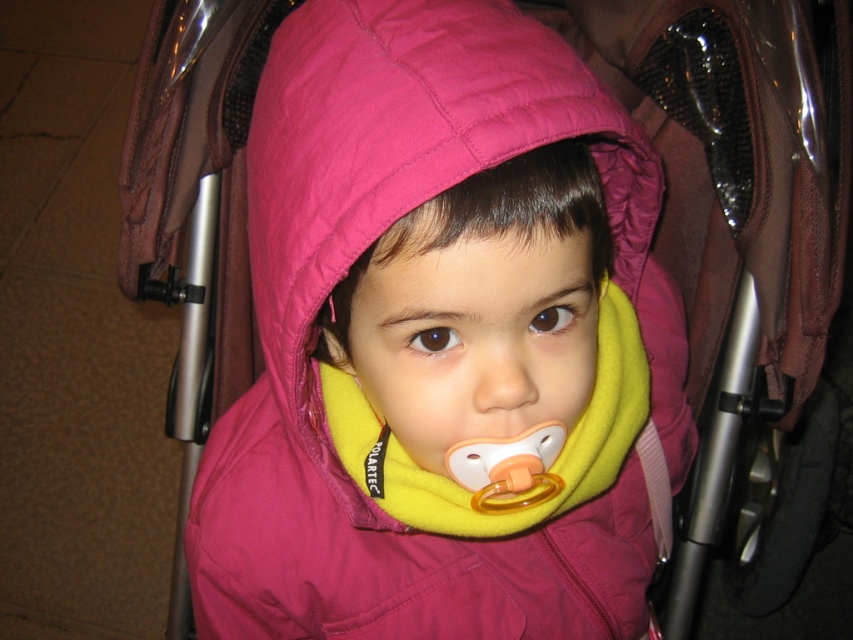
A toy car is 3 inches long. If you place it between the pink fleece jacket at center and the yellow rubber teething ring at center, will it fit without overlapping either object?

The distance between the pink fleece jacket at center and the yellow rubber teething ring at center is 3.51 inches. Since the toy car is 3 inches long, it will fit between them without overlapping either object.

You are a parent trying to ensure your child stays warm in the stroller. The child is wearing a pink fleece jacket at center and has a yellow rubber teething ring at center. Which item is taller and would provide more coverage against the cold?

The pink fleece jacket at center is much taller than the yellow rubber teething ring at center, so it provides more coverage against the cold.

You are a photographer trying to capture a closeup of the yellow rubber teething ring at center. However, the pink fleece jacket at center is blocking your view. Can you adjust your position to see the teething ring without moving any objects?

The pink fleece jacket at center is closer to the viewer than the yellow rubber teething ring at center. To see the teething ring without moving objects, you would need to move your camera position behind the jacket so that the teething ring becomes visible beyond it.